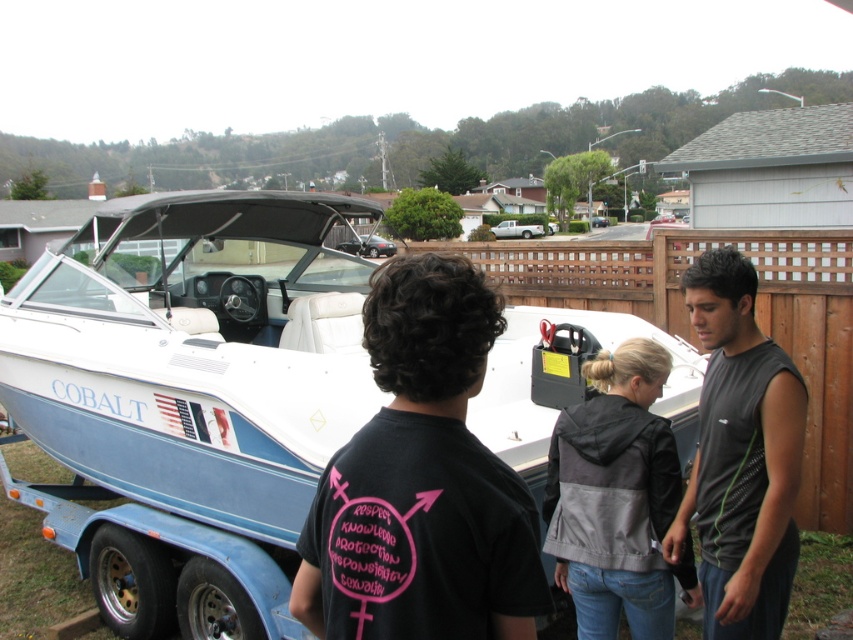
You are a photographer trying to capture a photo of the white glossy boat at center and the black sleeveless shirt at center. Since you want both subjects to appear equally prominent in the photo, which one should you zoom in on more?

The white glossy boat at center is larger in size than the black sleeveless shirt at center, so you should zoom in more on the black sleeveless shirt at center to make it appear larger in the photo and balance its prominence with the boat.

You are standing at the origin point of the coordinate system. The white glossy boat at center is located at point 0.620, 0.224. If you want to walk directly to the boat, which direction should you head?

The white glossy boat at center is located at coordinate point (x=190, y=396). Since the x coordinate is positive, you should head east, and since the y coordinate is positive, you should head north. Therefore, you should head northeast to reach the boat.

You are standing in a parking lot and see the white glossy boat at center. If you want to touch the boat, how many steps do you need to take if each step covers 0.75 meters?

The white glossy boat at center is 2.52 meters away. Each step covers 0.75 meters. Dividing 2.52 by 0.75 gives approximately 3.36 steps. Since you can only take whole steps, you would need to take 4 steps to reach the boat.